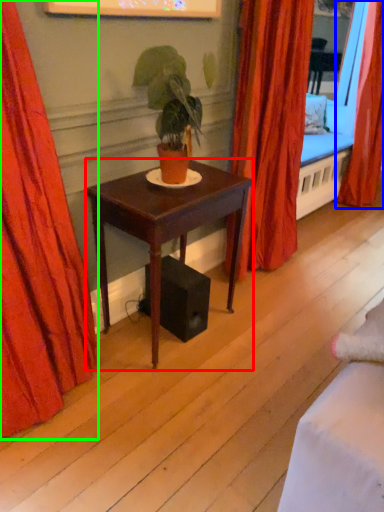
Question: Considering the real-world distances, which object is farthest from desk (highlighted by a red box)? curtain (highlighted by a blue box) or curtain (highlighted by a green box)?

Choices:
 (A) curtain
 (B) curtain

Answer: (A)